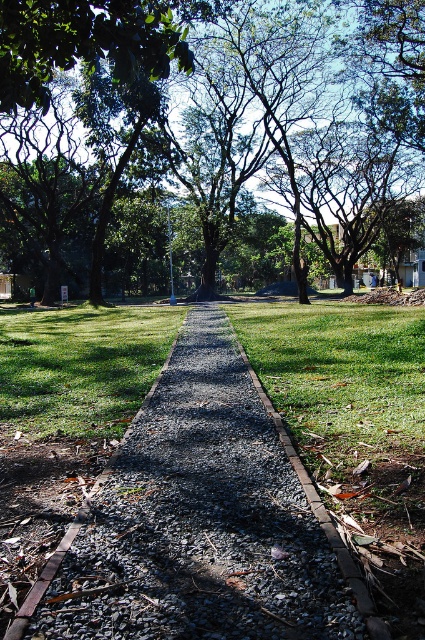
Is gray gravel at center below green leafy tree at center?

Correct, gray gravel at center is located below green leafy tree at center.

Does gray gravel at center have a lesser height compared to green leafy tree at center?

Indeed, gray gravel at center has a lesser height compared to green leafy tree at center.

Describe the element at coordinates (201, 518) in the screenshot. I see `gray gravel at center` at that location.

Identify the location of gray gravel at center. coord(201,518).